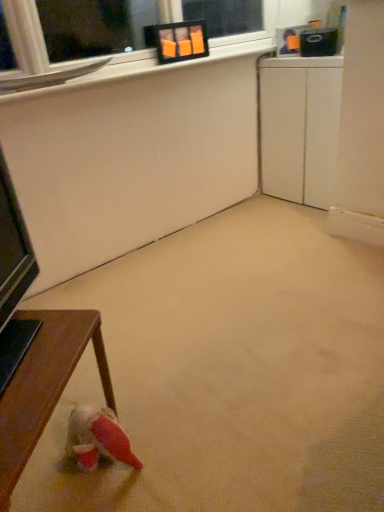
What is the approximate width of wooden table at lower left?

It is 16.08 inches.

At what (x,y) coordinates should I click in order to perform the action: click on wooden table at lower left. Please return your answer as a coordinate pair (x, y). Looking at the image, I should click on (45, 385).

Identify the location of concrete located above the wooden table at lower left (from the image's perspective). The image size is (384, 512). (230, 372).

Is beige carpet at center wider than wooden table at lower left?

Correct, the width of beige carpet at center exceeds that of wooden table at lower left.

How many degrees apart are the facing directions of beige carpet at center and wooden table at lower left?

132 degrees separate the facing orientations of beige carpet at center and wooden table at lower left.

Does beige carpet at center have a larger size compared to wooden table at lower left?

Indeed, beige carpet at center has a larger size compared to wooden table at lower left.

Is white matte cabinet at right far away from wooden table at lower left?

Yes.

Find the location of a particular element. table to the left of white matte cabinet at right is located at coordinates (45, 385).

Could you tell me if white matte cabinet at right is turned towards wooden table at lower left?

Yes, white matte cabinet at right faces towards wooden table at lower left.

In the scene shown: Relative to wooden table at lower left, is white matte cabinet at right in front or behind?

Visually, white matte cabinet at right is located behind wooden table at lower left.

Consider the image. From a real-world perspective, between white matte cabinet at right and beige carpet at center, who is vertically higher?

white matte cabinet at right, from a real-world perspective.

Is white matte cabinet at right turned away from beige carpet at center?

white matte cabinet at right does not have its back to beige carpet at center.

Is point (278, 187) closer or farther from the camera than point (271, 311)?

Point (278, 187) is farther from the camera than point (271, 311).

Considering the sizes of objects wooden table at lower left and white matte cabinet at right in the image provided, who is smaller, wooden table at lower left or white matte cabinet at right?

wooden table at lower left is smaller.

Which is farther from the camera, [22,435] or [271,139]?

The point [271,139] is farther from the camera.

How far apart are wooden table at lower left and white matte cabinet at right?

The distance of wooden table at lower left from white matte cabinet at right is 6.68 feet.

From the image's perspective, is wooden table at lower left located above or below white matte cabinet at right?

Clearly, from the image's perspective, wooden table at lower left is below white matte cabinet at right.

Is beige carpet at center completely or partially inside wooden table at lower left?

No, beige carpet at center is not a part of wooden table at lower left.

From the image's perspective, does wooden table at lower left appear higher than beige carpet at center?

Incorrect, from the image's perspective, wooden table at lower left is lower than beige carpet at center.

Between wooden table at lower left and beige carpet at center, which one appears on the right side from the viewer's perspective?

beige carpet at center is more to the right.

Which of these two, beige carpet at center or white matte cabinet at right, is wider?

beige carpet at center.

Does beige carpet at center have a greater height compared to white matte cabinet at right?

In fact, beige carpet at center may be shorter than white matte cabinet at right.

From the image's perspective, is beige carpet at center above or below white matte cabinet at right?

beige carpet at center is situated lower than white matte cabinet at right in the image.

From a real-world perspective, between beige carpet at center and white matte cabinet at right, who is vertically lower?

beige carpet at center.

The height and width of the screenshot is (512, 384). In order to click on table behind the beige carpet at center in this screenshot , I will do `click(45, 385)`.

The image size is (384, 512). Identify the location of computer desk above the wooden table at lower left (from the image's perspective). tap(299, 128).

From the picture: Considering their positions, is white matte cabinet at right positioned closer to wooden table at lower left than beige carpet at center?

The object closer to wooden table at lower left is beige carpet at center.

From the image, which object appears to be farther from white matte cabinet at right, wooden table at lower left or beige carpet at center?

wooden table at lower left is further to white matte cabinet at right.

In the scene shown: When comparing their distances from white matte cabinet at right, does beige carpet at center or wooden table at lower left seem further?

The object further to white matte cabinet at right is wooden table at lower left.

Which object lies nearer to the anchor point beige carpet at center, white matte cabinet at right or wooden table at lower left?

wooden table at lower left is positioned closer to the anchor beige carpet at center.

Considering their positions, is wooden table at lower left positioned closer to beige carpet at center than white matte cabinet at right?

Among the two, wooden table at lower left is located nearer to beige carpet at center.

Based on their spatial positions, is beige carpet at center or white matte cabinet at right further from wooden table at lower left?

white matte cabinet at right is further to wooden table at lower left.

Image resolution: width=384 pixels, height=512 pixels. Identify the location of table between beige carpet at center and white matte cabinet at right along the z-axis. (45, 385).